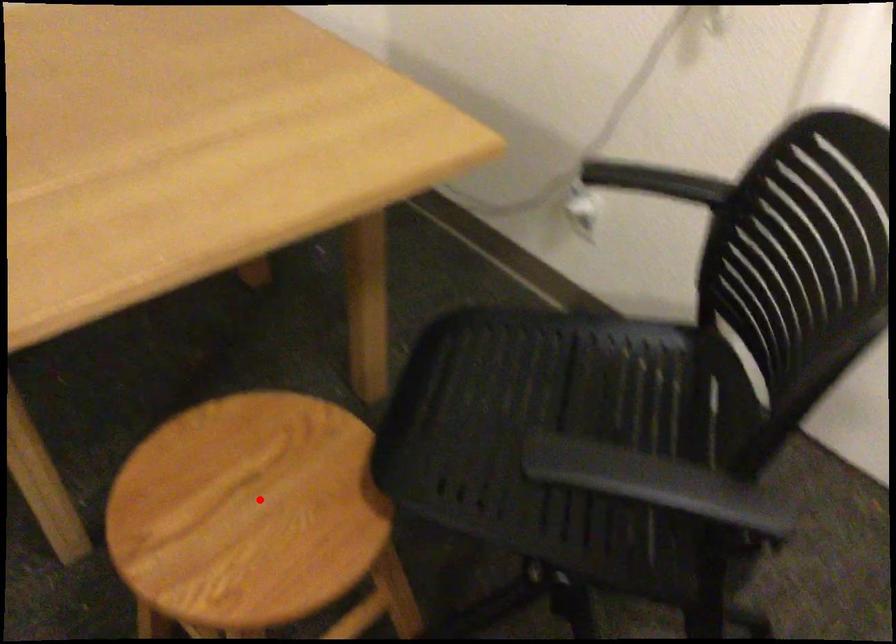
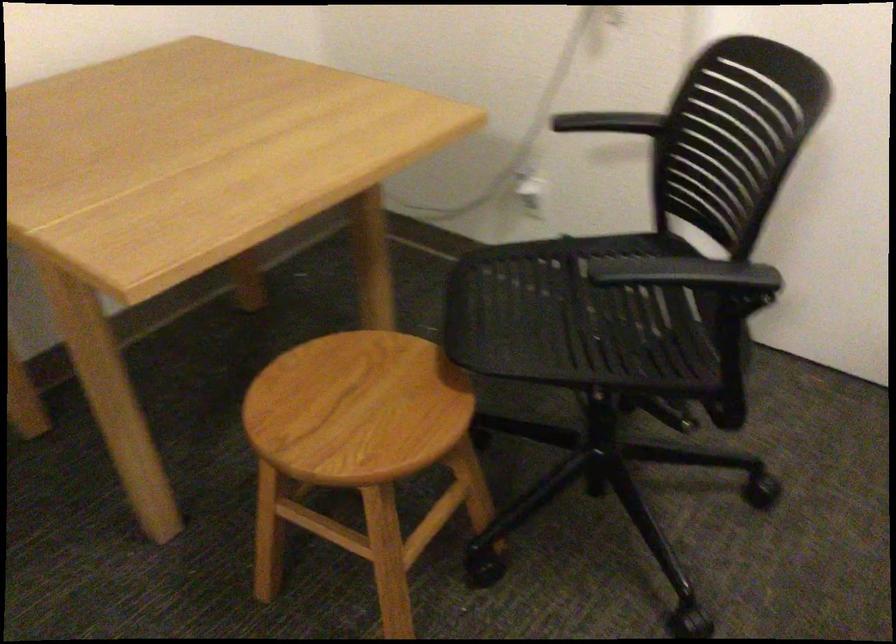
Question: I am providing you with two images of the same scene from different viewpoints. In image1, a red point is highlighted. Considering the same 3D point in image2, which of the following is correct?

Choices:
 (A) It is closer
 (B) It is farther

Answer: (B)